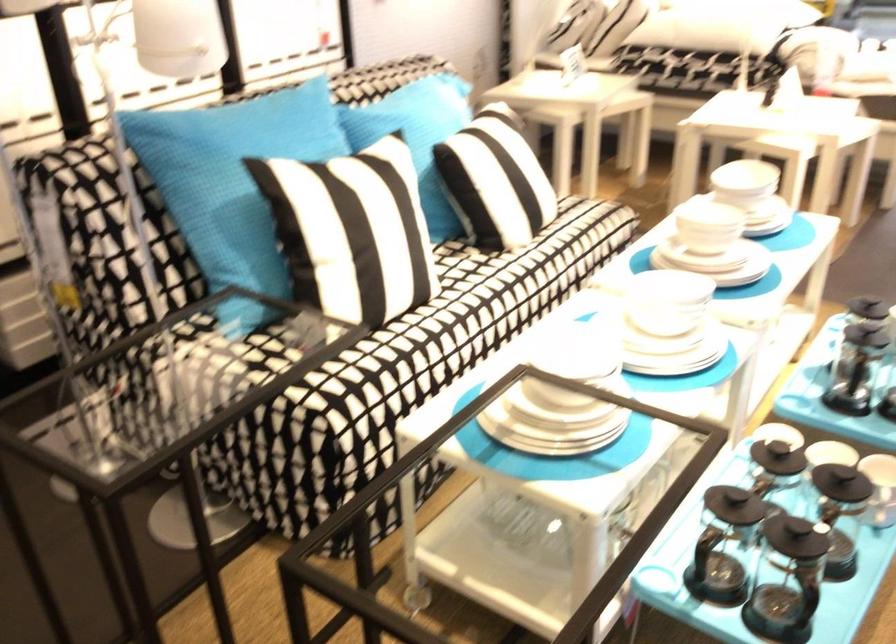
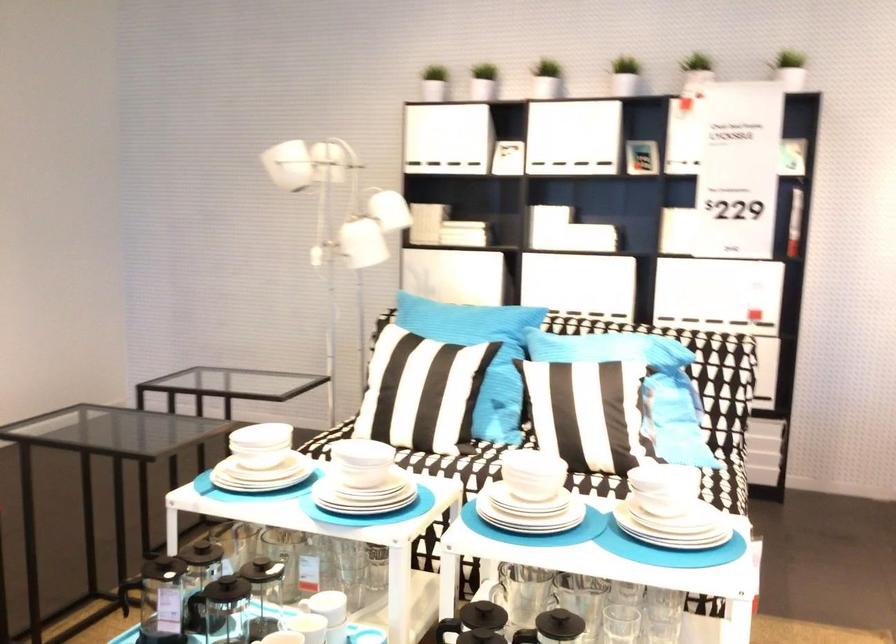
Find the pixel in the second image that matches pixel 777 184 in the first image.

(661, 489)